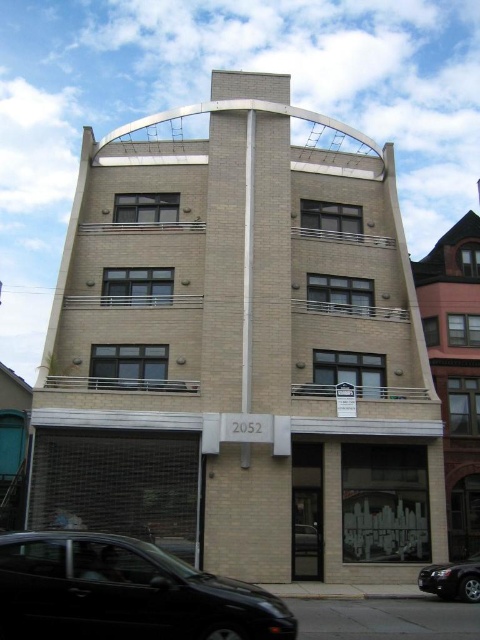
Question: Does shiny black car at lower left appear on the left side of black glossy sedan at lower right?

Choices:
 (A) no
 (B) yes

Answer: (B)

Question: Which point is farther to the camera?

Choices:
 (A) black glossy sedan at lower right
 (B) shiny black car at lower left

Answer: (A)

Question: Which of the following is the closest to the observer?

Choices:
 (A) (157, 586)
 (B) (451, 582)

Answer: (A)

Question: Which of the following is the closest to the observer?

Choices:
 (A) shiny black car at lower left
 (B) black glossy sedan at lower right

Answer: (A)

Question: Is shiny black car at lower left smaller than black glossy sedan at lower right?

Choices:
 (A) no
 (B) yes

Answer: (A)

Question: Observing the image, what is the correct spatial positioning of shiny black car at lower left in reference to black glossy sedan at lower right?

Choices:
 (A) right
 (B) left

Answer: (B)